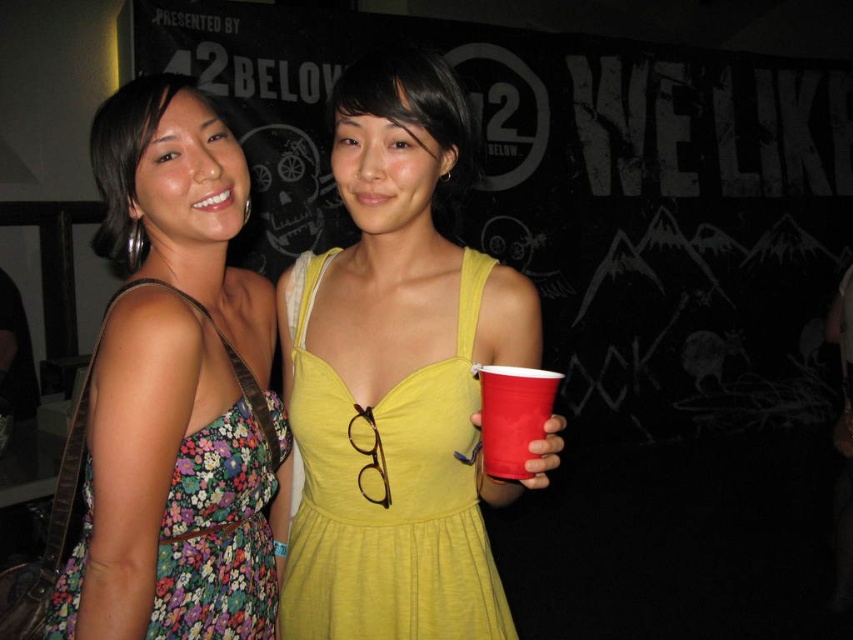
You are at a party and want to take a photo of the red plastic cup at center without the floral fabric dress at left blocking it. What should you do?

Move to the side so the red plastic cup at center is no longer blocked by the floral fabric dress at left since the red plastic cup at center is behind the dress.